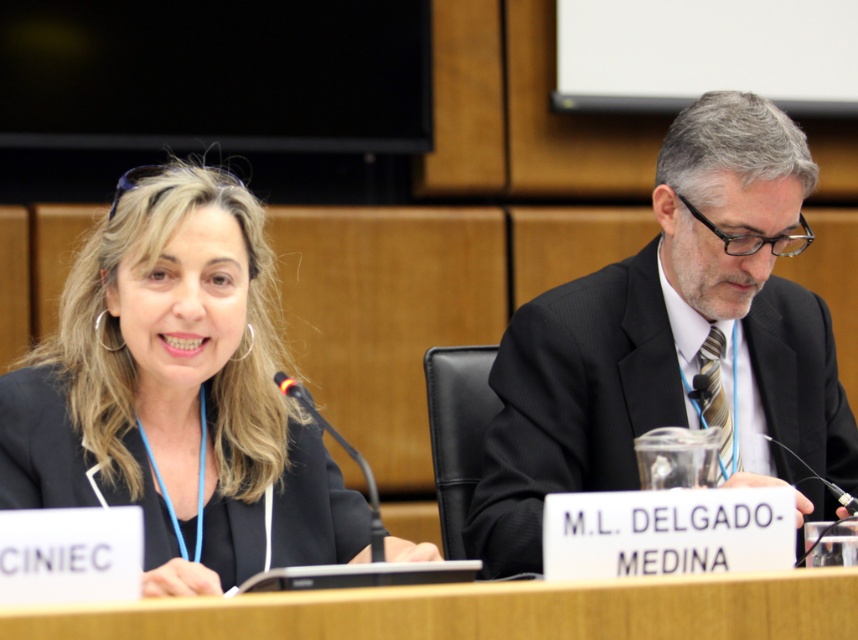
Based on the scene description, where is the black suit at right located in terms of coordinates?

The black suit at right is located at point (x=666, y=336).

Based on the photo, you are attending a formal meeting and need to place a document on the table. Which object should you approach first, the matte black blazer at center or the wooden table at center?

You should approach the wooden table at center first because it is behind the matte black blazer at center, meaning the table is farther away from you. To reach the table, you would need to move past the blazer first.